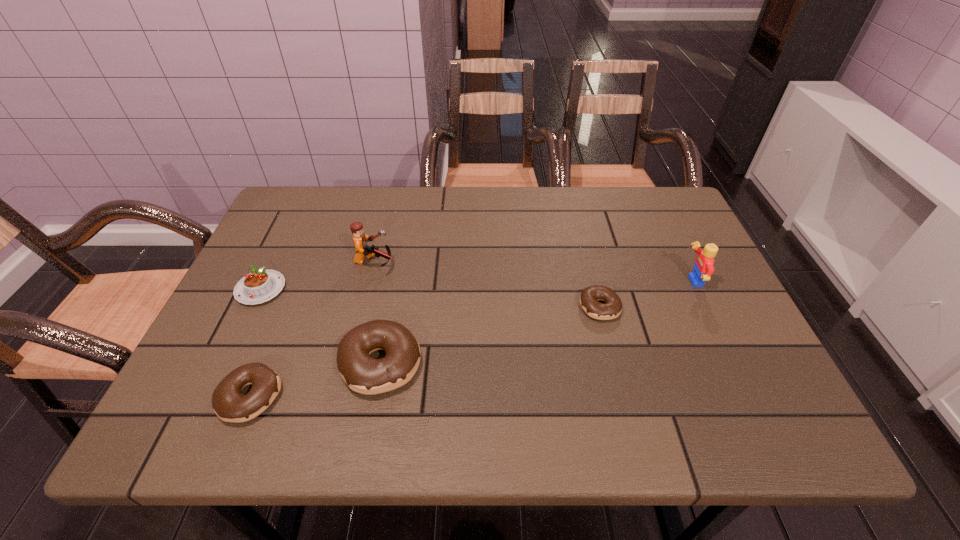
I want to click on the second shortest doughnut, so click(230, 405).

What are the coordinates of `the fourth shortest object` in the screenshot? It's located at (363, 374).

This screenshot has width=960, height=540. I want to click on the tallest doughnut, so click(363, 374).

Locate an element on the screen. The image size is (960, 540). the shortest object is located at coordinates (589, 297).

Image resolution: width=960 pixels, height=540 pixels. What are the coordinates of `the second object from right to left` in the screenshot? It's located at (589, 297).

You are a GUI agent. You are given a task and a screenshot of the screen. Output one action in this format:
    pyautogui.click(x=<x>, y=<y>)
    Task: Click on the pudding
    The height and width of the screenshot is (540, 960).
    Given the screenshot: What is the action you would take?
    pyautogui.click(x=259, y=286)

Find the location of `the left Lego`. the left Lego is located at coordinates (360, 239).

The height and width of the screenshot is (540, 960). What are the coordinates of `the rightmost object` in the screenshot? It's located at (703, 269).

This screenshot has width=960, height=540. What are the coordinates of `free space located 0.240m on the back of the second shortest doughnut` in the screenshot? It's located at (295, 287).

The image size is (960, 540). In order to click on vacant space located on the right of the third tallest object in this screenshot , I will do `click(563, 363)`.